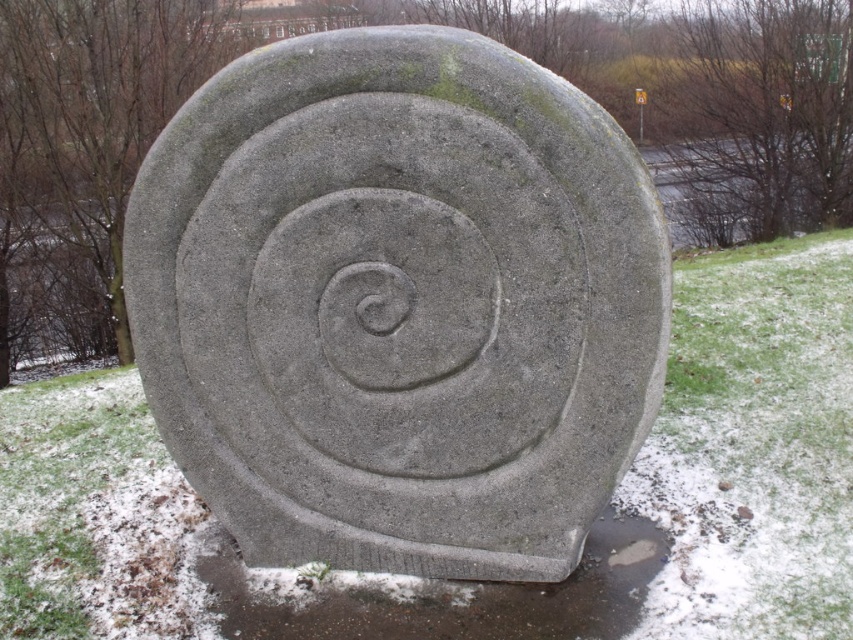
You are standing in the winter park and see the gray concrete spiral at center and the slick concrete puddle at lower center. Which object is positioned higher relative to the other?

The gray concrete spiral at center is located above the slick concrete puddle at lower center.

You are a park visitor trying to avoid getting your shoes wet. You see the gray concrete spiral at center and the slick concrete puddle at lower center. Which object should you step on to stay dry?

You should step on the gray concrete spiral at center because it is to the left of the slick concrete puddle at lower center, which is likely the wet area.

You are an artist planning to create a scale model of the sculpture and the puddle. Given that the slick concrete puddle at lower center is 20 cm in your model, how big should the gray concrete spiral at center be?

The gray concrete spiral at center has a larger size compared to the slick concrete puddle at lower center. If the puddle is 20 cm in the model, the spiral should be larger than 20 cm to maintain the size relationship.